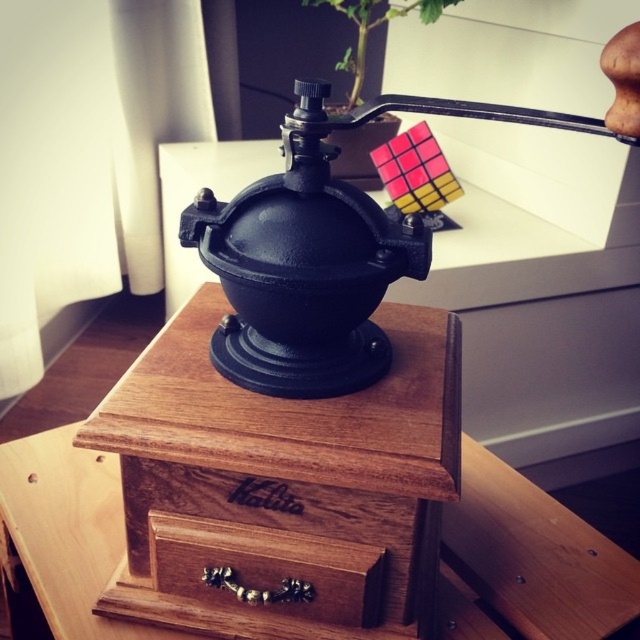
You are standing in front of the coffee grinder and want to place a small cup on top of it. Is there enough space between the black cast iron coffee grinder at center and the green leafy plant at upper center to place the cup?

The black cast iron coffee grinder at center is positioned under the green leafy plant at upper center, so there is space between them. You can safely place the cup on top of the coffee grinder without it touching the plant.

You are organizing a small space and need to know which object takes up more room. Which occupies more space between the brown wood drawer at center and the green leafy plant at upper center?

The green leafy plant at upper center occupies more space than the brown wood drawer at center.